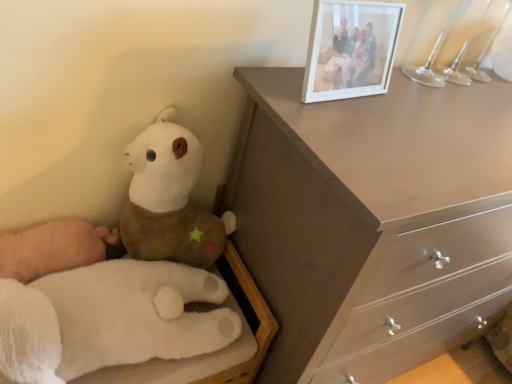
Question: Is matte brown dresser at upper right wider than white plush toy at left, acting as the first toy starting from the top?

Choices:
 (A) yes
 (B) no

Answer: (A)

Question: From the image's perspective, is matte brown dresser at upper right beneath white plush toy at left, acting as the first toy starting from the top?

Choices:
 (A) yes
 (B) no

Answer: (A)

Question: Is matte brown dresser at upper right oriented towards white plush toy at left, which ranks as the second toy in bottom-to-top order?

Choices:
 (A) no
 (B) yes

Answer: (A)

Question: From a real-world perspective, does matte brown dresser at upper right stand above white plush toy at left, which ranks as the second toy in bottom-to-top order?

Choices:
 (A) no
 (B) yes

Answer: (A)

Question: Does matte brown dresser at upper right have a smaller size compared to white plush toy at left, acting as the first toy starting from the top?

Choices:
 (A) no
 (B) yes

Answer: (A)

Question: In terms of height, does white plush toy at left, which ranks as the second toy in bottom-to-top order, look taller or shorter compared to matte brown dresser at upper right?

Choices:
 (A) tall
 (B) short

Answer: (B)

Question: Looking at the image, does white plush toy at left, acting as the first toy starting from the top, seem bigger or smaller compared to matte brown dresser at upper right?

Choices:
 (A) big
 (B) small

Answer: (B)

Question: Is point (129, 215) positioned closer to the camera than point (278, 135)?

Choices:
 (A) farther
 (B) closer

Answer: (A)

Question: Looking at their shapes, would you say white plush toy at left, acting as the first toy starting from the top, is wider or thinner than matte brown dresser at upper right?

Choices:
 (A) wide
 (B) thin

Answer: (B)

Question: Relative to white plush hand at lower left, which is the first toy in bottom-to-top order, is white plastic picture frame at upper right in front or behind?

Choices:
 (A) front
 (B) behind

Answer: (B)

Question: Is white plastic picture frame at upper right inside or outside of white plush hand at lower left, the second toy from the top?

Choices:
 (A) inside
 (B) outside

Answer: (B)

Question: Visually, is white plastic picture frame at upper right positioned to the left or to the right of white plush hand at lower left, the second toy from the top?

Choices:
 (A) right
 (B) left

Answer: (A)

Question: In terms of height, does white plastic picture frame at upper right look taller or shorter compared to white plush hand at lower left, the second toy from the top?

Choices:
 (A) tall
 (B) short

Answer: (A)

Question: Considering the relative positions of white plush hand at lower left, the second toy from the top, and white plastic picture frame at upper right in the image provided, is white plush hand at lower left, the second toy from the top, to the left or to the right of white plastic picture frame at upper right?

Choices:
 (A) left
 (B) right

Answer: (A)

Question: From their relative heights in the image, would you say white plush hand at lower left, which is the first toy in bottom-to-top order, is taller or shorter than white plastic picture frame at upper right?

Choices:
 (A) tall
 (B) short

Answer: (B)